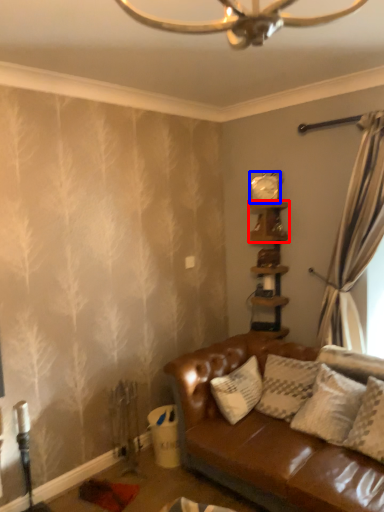
Question: Among these objects, which one is nearest to the camera, shelf (highlighted by a red box) or clock (highlighted by a blue box)?

Choices:
 (A) shelf
 (B) clock

Answer: (A)